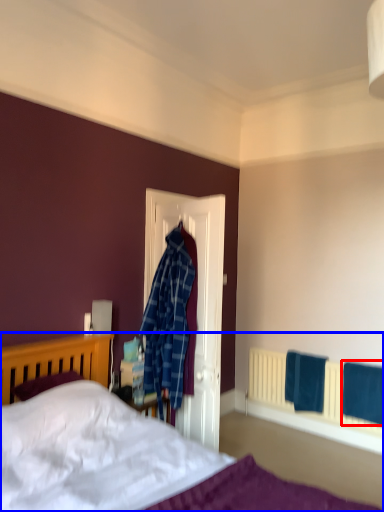
Question: Among these objects, which one is nearest to the camera, bath towel (highlighted by a red box) or bed (highlighted by a blue box)?

Choices:
 (A) bath towel
 (B) bed

Answer: (B)